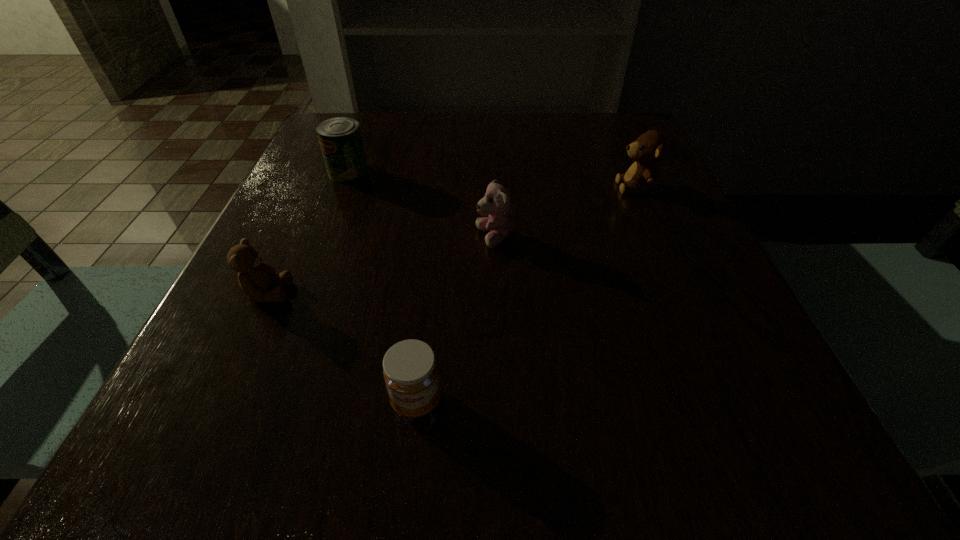
At what (x,y) coordinates should I click in order to perform the action: click on the rightmost object. Please return your answer as a coordinate pair (x, y). The width and height of the screenshot is (960, 540). Looking at the image, I should click on (648, 149).

This screenshot has height=540, width=960. I want to click on the farthest teddy bear, so click(648, 149).

This screenshot has width=960, height=540. In order to click on the third farthest object in this screenshot , I will do `click(496, 204)`.

Find the location of a particular element. the second object from right to left is located at coordinates (496, 204).

Locate an element on the screen. This screenshot has width=960, height=540. can is located at coordinates pyautogui.click(x=340, y=139).

This screenshot has width=960, height=540. I want to click on the nearest teddy bear, so tap(256, 278).

Locate an element on the screen. The image size is (960, 540). the second nearest object is located at coordinates (256, 278).

Locate an element on the screen. the nearest object is located at coordinates (410, 370).

Locate an element on the screen. This screenshot has height=540, width=960. jam is located at coordinates (410, 370).

This screenshot has width=960, height=540. I want to click on vacant space located on the face of the farthest teddy bear, so click(588, 187).